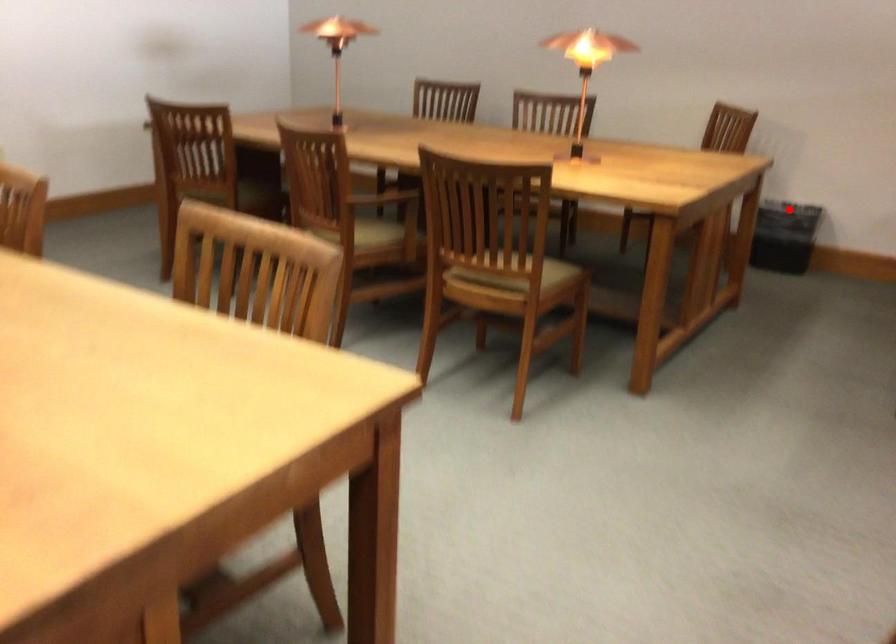
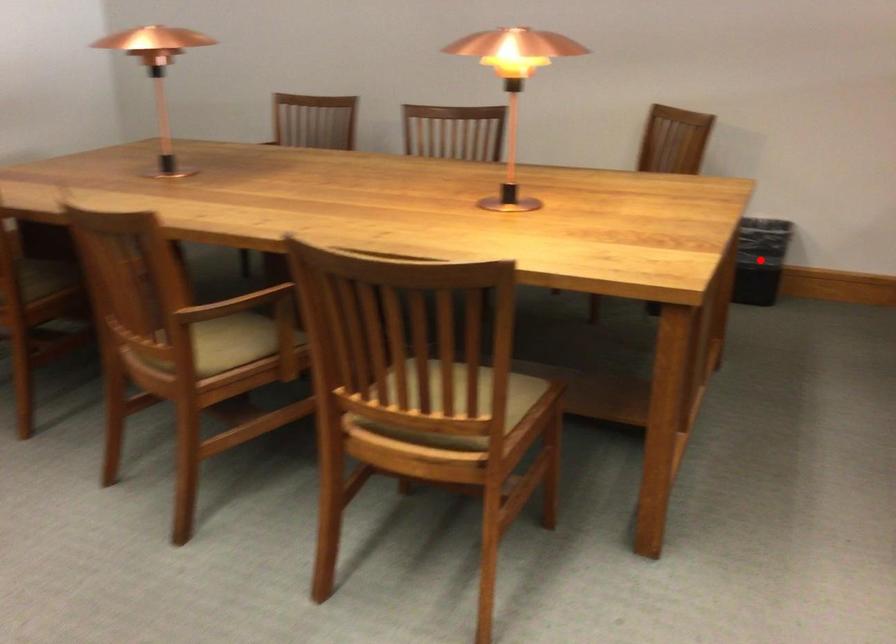
I am providing you with two images of the same scene from different viewpoints. A red point is marked on the first image and another point is marked on the second image. Is the red point in image1 aligned with the point shown in image2?

Yes